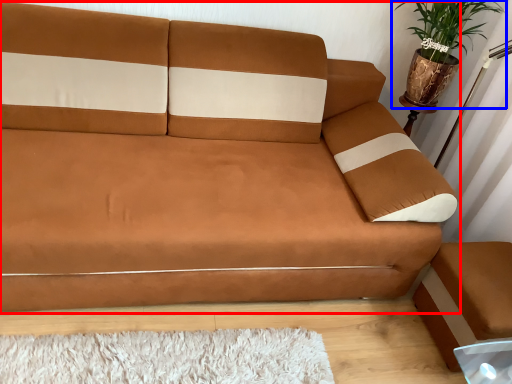
Question: Which point is closer to the camera, studio couch (highlighted by a red box) or houseplant (highlighted by a blue box)?

Choices:
 (A) studio couch
 (B) houseplant

Answer: (A)